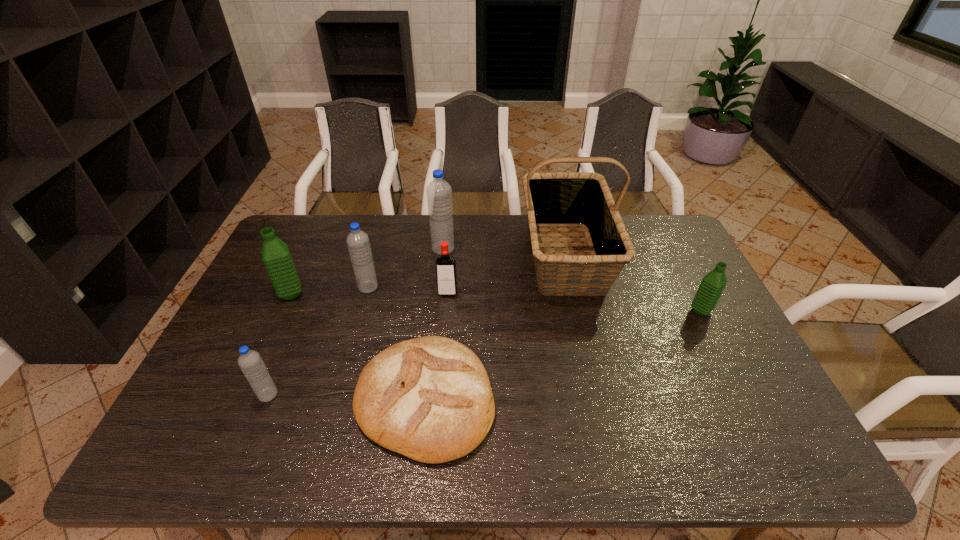
Locate an element on the screen. Image resolution: width=960 pixels, height=540 pixels. vacant space situated 0.240m on the back of the shortest object is located at coordinates (437, 286).

Where is `basket located at the far edge`? basket located at the far edge is located at coordinates [x=553, y=199].

What are the coordinates of `water bottle that is at the far edge` in the screenshot? It's located at (439, 192).

Locate an element on the screen. Image resolution: width=960 pixels, height=540 pixels. object at the near edge is located at coordinates (429, 398).

Locate an element on the screen. The height and width of the screenshot is (540, 960). object that is at the left edge is located at coordinates (276, 257).

At what (x,y) coordinates should I click in order to perform the action: click on object at the right edge. Please return your answer as a coordinate pair (x, y). This screenshot has height=540, width=960. Looking at the image, I should click on (711, 287).

This screenshot has height=540, width=960. What are the coordinates of `free space at the far edge` in the screenshot? It's located at (326, 245).

The image size is (960, 540). I want to click on vacant space at the near edge of the desktop, so click(711, 467).

I want to click on free space at the left edge of the desktop, so click(x=199, y=387).

Find the location of a particular element. This screenshot has height=540, width=960. vacant space at the right edge of the desktop is located at coordinates (711, 380).